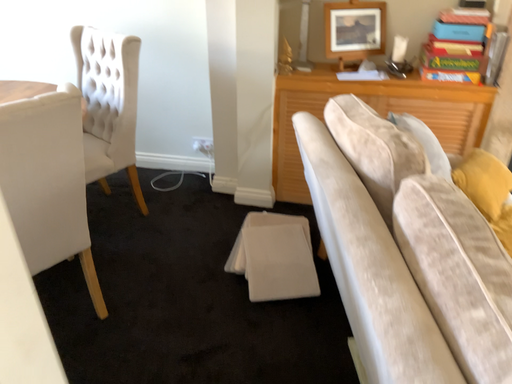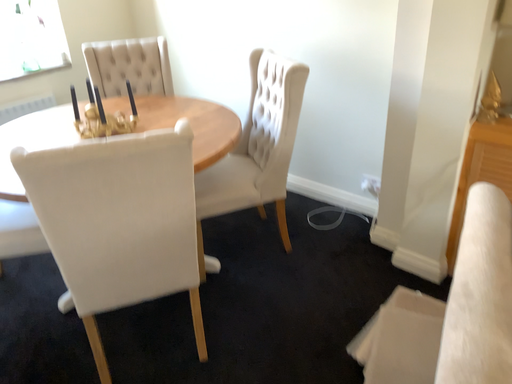
Question: Which way did the camera rotate in the video?

Choices:
 (A) rotated left
 (B) rotated right

Answer: (A)